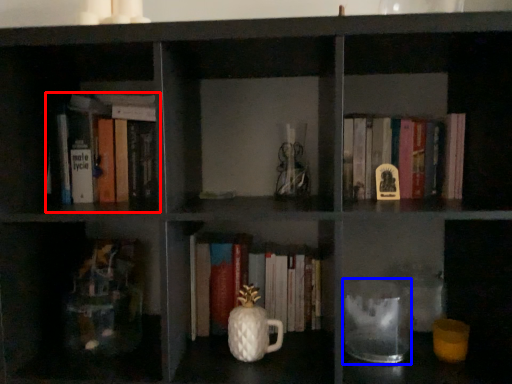
Question: Among these objects, which one is nearest to the camera, book (highlighted by a red box) or glass jar (highlighted by a blue box)?

Choices:
 (A) book
 (B) glass jar

Answer: (B)